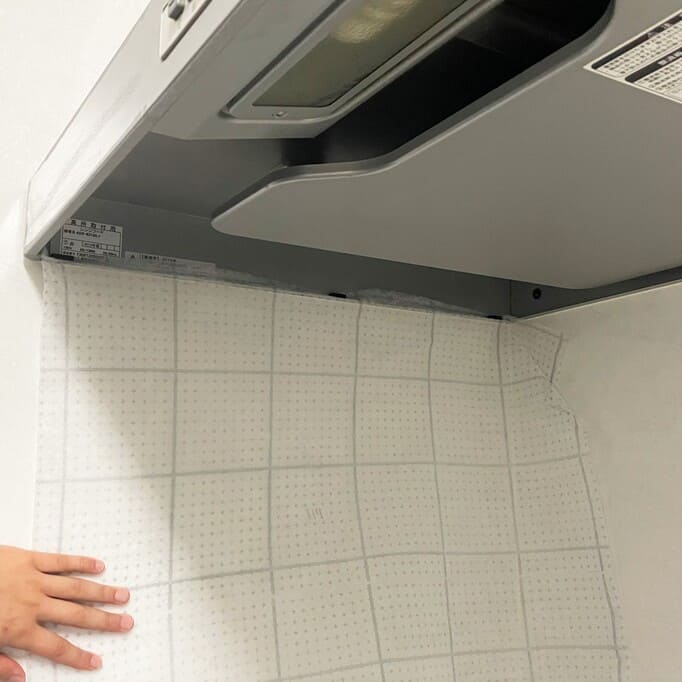
Find the location of `wall mounting screw`. wall mounting screw is located at coordinates (537, 293).